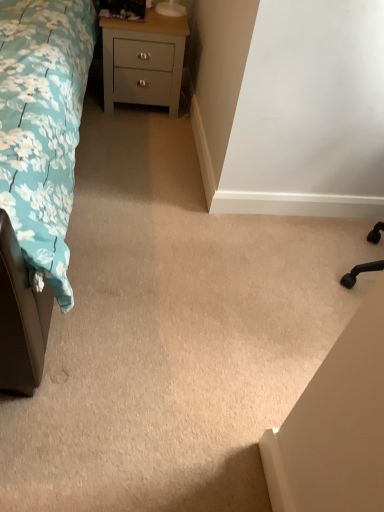
Identify the location of free space on the front side of light gray painted wood chest of drawers at upper left. (142, 129).